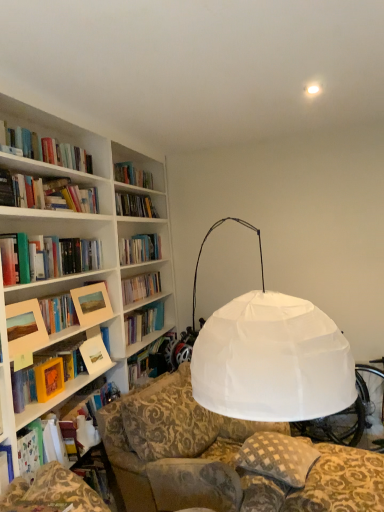
Question: Is matte white book at left, placed as the second paperback book when sorted from front to back, far away from yellow matte paper at left, the 2th paperback book when ordered from back to front?

Choices:
 (A) yes
 (B) no

Answer: (B)

Question: Could you tell me if matte white book at left, marked as the 1th paperback book in a back-to-front arrangement, is facing yellow matte paper at left, marked as the second paperback book in a right-to-left arrangement?

Choices:
 (A) no
 (B) yes

Answer: (A)

Question: From the image's perspective, is matte white book at left, placed as the second paperback book when sorted from front to back, located beneath yellow matte paper at left, marked as the second paperback book in a right-to-left arrangement?

Choices:
 (A) no
 (B) yes

Answer: (A)

Question: Considering the relative sizes of matte white book at left, which is counted as the 1th paperback book, starting from the right, and yellow matte paper at left, arranged as the 1th paperback book when viewed from the front, in the image provided, is matte white book at left, which is counted as the 1th paperback book, starting from the right, taller than yellow matte paper at left, arranged as the 1th paperback book when viewed from the front,?

Choices:
 (A) no
 (B) yes

Answer: (B)

Question: Can you confirm if matte white book at left, which ranks as the 2th paperback book in left-to-right order, is thinner than yellow matte paper at left, the first paperback book in the left-to-right sequence?

Choices:
 (A) yes
 (B) no

Answer: (B)

Question: From their relative heights in the image, would you say matte white book at left, which is counted as the 1th paperback book, starting from the right, is taller or shorter than checkered fabric pillow at lower center?

Choices:
 (A) tall
 (B) short

Answer: (A)

Question: Considering the positions of matte white book at left, marked as the 1th paperback book in a back-to-front arrangement, and checkered fabric pillow at lower center in the image, is matte white book at left, marked as the 1th paperback book in a back-to-front arrangement, wider or thinner than checkered fabric pillow at lower center?

Choices:
 (A) wide
 (B) thin

Answer: (B)

Question: Is matte white book at left, placed as the second paperback book when sorted from front to back, spatially inside checkered fabric pillow at lower center, or outside of it?

Choices:
 (A) inside
 (B) outside

Answer: (B)

Question: Considering the positions of point (92, 355) and point (294, 480), is point (92, 355) closer or farther from the camera than point (294, 480)?

Choices:
 (A) closer
 (B) farther

Answer: (B)

Question: Considering the positions of checkered fabric pillow at lower center and matte white book at left, which ranks as the 2th paperback book in left-to-right order, in the image, is checkered fabric pillow at lower center taller or shorter than matte white book at left, which ranks as the 2th paperback book in left-to-right order,?

Choices:
 (A) tall
 (B) short

Answer: (B)

Question: From the image's perspective, is checkered fabric pillow at lower center positioned above or below matte white book at left, placed as the second paperback book when sorted from front to back?

Choices:
 (A) above
 (B) below

Answer: (B)

Question: In the image, is checkered fabric pillow at lower center positioned in front of or behind matte white book at left, which ranks as the 2th paperback book in left-to-right order?

Choices:
 (A) behind
 (B) front

Answer: (B)

Question: Which is correct: checkered fabric pillow at lower center is inside matte white book at left, marked as the 1th paperback book in a back-to-front arrangement, or outside of it?

Choices:
 (A) inside
 (B) outside

Answer: (B)

Question: In terms of height, does matte wooden picture frame at upper left, positioned as the 2th picture frame in left-to-right order, look taller or shorter compared to yellow matte paper at left, marked as the second paperback book in a right-to-left arrangement?

Choices:
 (A) tall
 (B) short

Answer: (A)

Question: Is matte wooden picture frame at upper left, the 2th picture frame viewed from the front, inside the boundaries of yellow matte paper at left, arranged as the 1th paperback book when viewed from the front, or outside?

Choices:
 (A) inside
 (B) outside

Answer: (B)